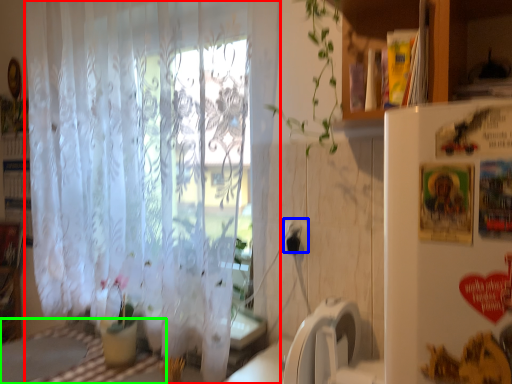
Question: Which object is positioned farthest from curtain (highlighted by a red box)? Select from electric outlet (highlighted by a blue box) and table (highlighted by a green box).

Choices:
 (A) electric outlet
 (B) table

Answer: (A)